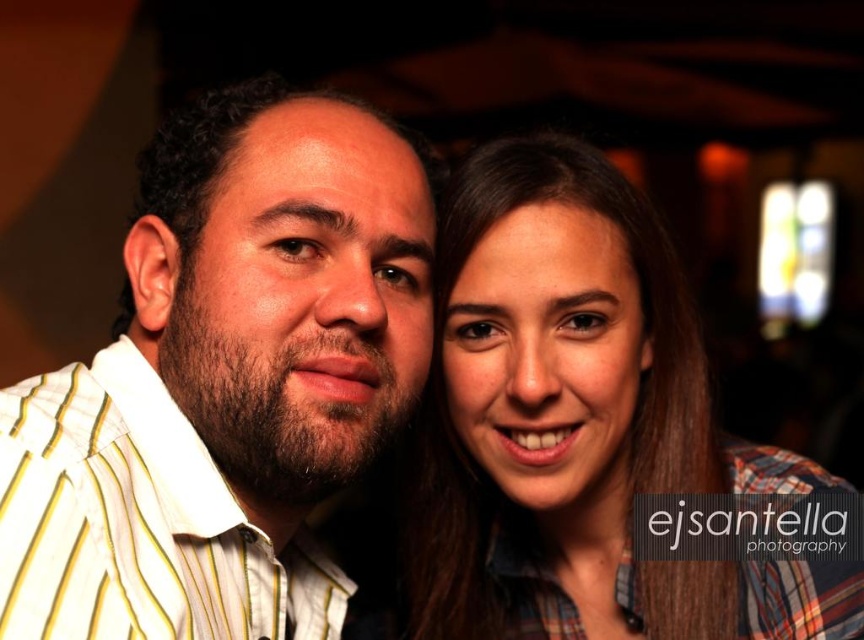
You are a photographer trying to adjust the lighting for a portrait. You notice the white striped shirt at center and the plaid shirt at center in the frame. Which shirt should you focus the light on to ensure the upper part of the subject is properly illuminated?

The white striped shirt at center is located above the plaid shirt at center, so you should focus the light on the white striped shirt at center to ensure the upper part is properly illuminated.

You are at a party and want to take a photo of the two people wearing the white striped shirt at center and the plaid shirt at center. Since the background is dimly lit, you need to position them so that the brighter areas of their shirts reflect more light. Which shirt should you place closer to the light source to ensure better visibility?

The white striped shirt at center should be placed closer to the light source because white reflects more light than plaid patterns, making it more visible in the dimly lit background.